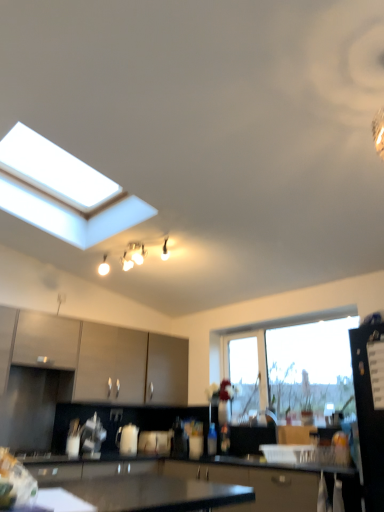
Question: From a real-world perspective, is black glossy refrigerator at right, which ranks as the 2th appliance in bottom-to-top order, on matte white light fixture at upper center?

Choices:
 (A) yes
 (B) no

Answer: (B)

Question: From the image's perspective, is black glossy refrigerator at right, the 1th appliance when ordered from right to left, below matte white light fixture at upper center?

Choices:
 (A) no
 (B) yes

Answer: (B)

Question: Is the surface of black glossy refrigerator at right, the 1th appliance when ordered from right to left, in direct contact with matte white light fixture at upper center?

Choices:
 (A) yes
 (B) no

Answer: (B)

Question: Considering the relative sizes of black glossy refrigerator at right, which ranks as the 2th appliance in bottom-to-top order, and matte white light fixture at upper center in the image provided, is black glossy refrigerator at right, which ranks as the 2th appliance in bottom-to-top order, taller than matte white light fixture at upper center?

Choices:
 (A) yes
 (B) no

Answer: (A)

Question: Is black glossy refrigerator at right, acting as the second appliance starting from the left, positioned behind matte white light fixture at upper center?

Choices:
 (A) yes
 (B) no

Answer: (B)

Question: Is white glossy kettle at center, which is counted as the 2th appliance, starting from the front, wider or thinner than matte white light fixture at upper center?

Choices:
 (A) wide
 (B) thin

Answer: (B)

Question: Is white glossy kettle at center, which is counted as the 2th appliance, starting from the front, spatially inside matte white light fixture at upper center, or outside of it?

Choices:
 (A) inside
 (B) outside

Answer: (B)

Question: In terms of size, does white glossy kettle at center, which ranks as the 1th appliance in left-to-right order, appear bigger or smaller than matte white light fixture at upper center?

Choices:
 (A) small
 (B) big

Answer: (A)

Question: In terms of height, does white glossy kettle at center, which is the second appliance from right to left, look taller or shorter compared to matte white light fixture at upper center?

Choices:
 (A) tall
 (B) short

Answer: (B)

Question: Is matte white light fixture at upper center wider or thinner than transparent glass window at center?

Choices:
 (A) thin
 (B) wide

Answer: (B)

Question: From the image's perspective, is matte white light fixture at upper center located above or below transparent glass window at center?

Choices:
 (A) below
 (B) above

Answer: (B)

Question: Is matte white light fixture at upper center bigger or smaller than transparent glass window at center?

Choices:
 (A) big
 (B) small

Answer: (B)

Question: Considering the positions of point click(129, 262) and point click(331, 340), is point click(129, 262) closer or farther from the camera than point click(331, 340)?

Choices:
 (A) closer
 (B) farther

Answer: (B)

Question: In terms of height, does matte white light fixture at upper center look taller or shorter compared to black glossy refrigerator at right, which ranks as the 2th appliance in bottom-to-top order?

Choices:
 (A) short
 (B) tall

Answer: (A)

Question: Is point (104, 265) positioned closer to the camera than point (365, 345)?

Choices:
 (A) closer
 (B) farther

Answer: (B)